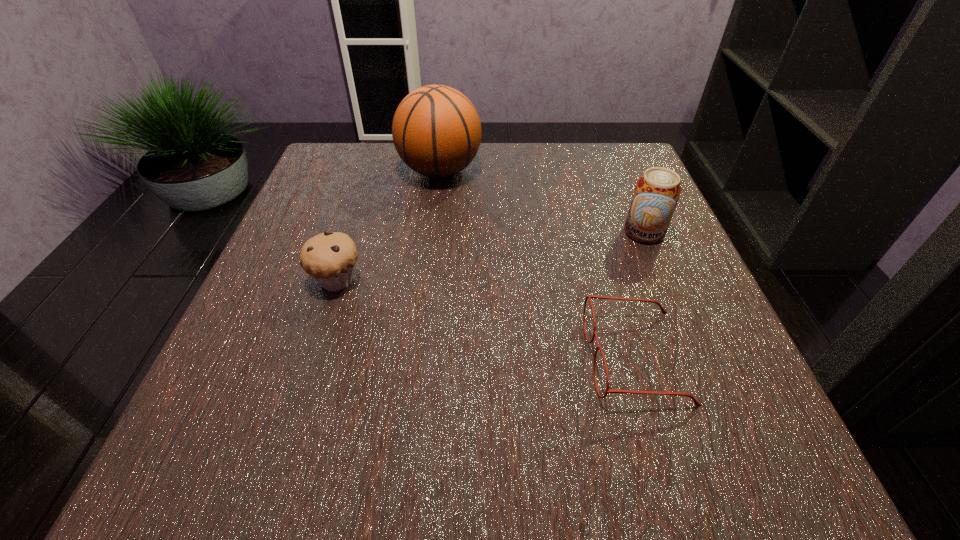
Find the location of a particular element. The width and height of the screenshot is (960, 540). the tallest object is located at coordinates click(436, 130).

At what (x,y) coordinates should I click in order to perform the action: click on basketball. Please return your answer as a coordinate pair (x, y). The height and width of the screenshot is (540, 960). Looking at the image, I should click on (436, 130).

This screenshot has width=960, height=540. Find the location of `the third nearest object`. the third nearest object is located at coordinates (657, 191).

Where is `the third shortest object`? The image size is (960, 540). the third shortest object is located at coordinates (657, 191).

In order to click on the leftmost object in this screenshot , I will do `click(329, 258)`.

In order to click on muffin in this screenshot , I will do `click(329, 258)`.

The width and height of the screenshot is (960, 540). Identify the location of the nearest object. (697, 404).

This screenshot has height=540, width=960. Find the location of `spectacles`. spectacles is located at coordinates (697, 404).

This screenshot has width=960, height=540. What are the coordinates of `vacant area located 0.390m on the front of the basketball` in the screenshot? It's located at (420, 335).

I want to click on vacant region located 0.340m on the left of the second tallest object, so click(454, 232).